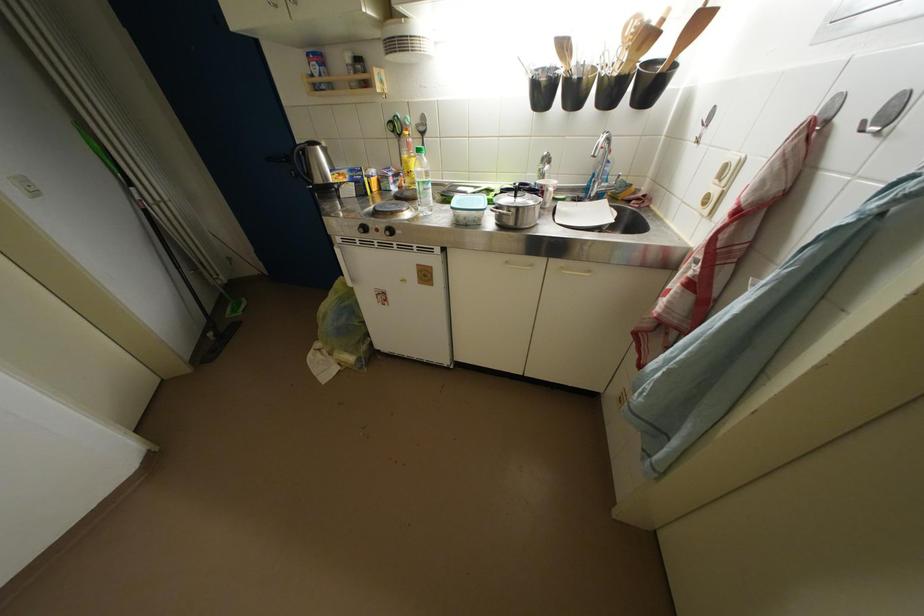
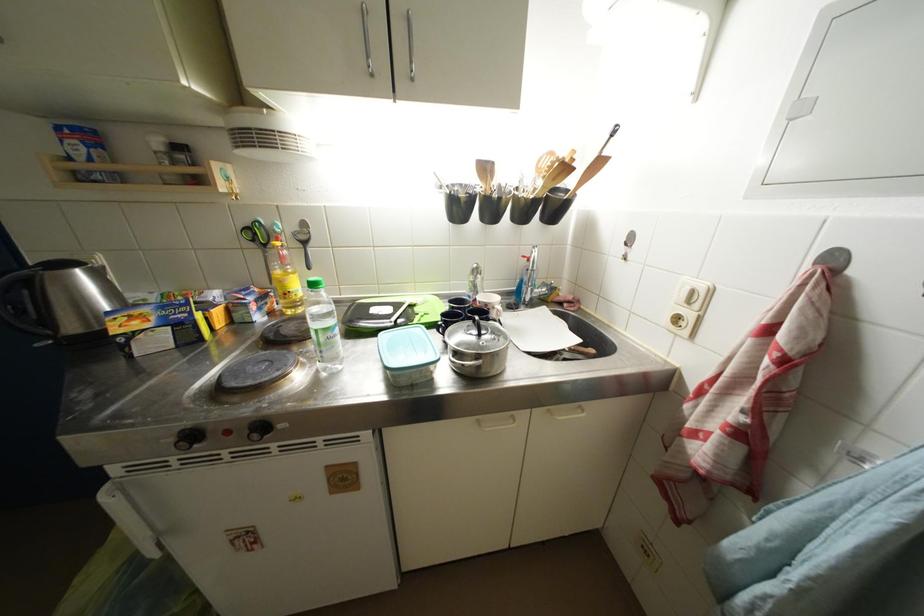
The point at (x=726, y=182) is marked in the first image. Where is the corresponding point in the second image?

(696, 306)